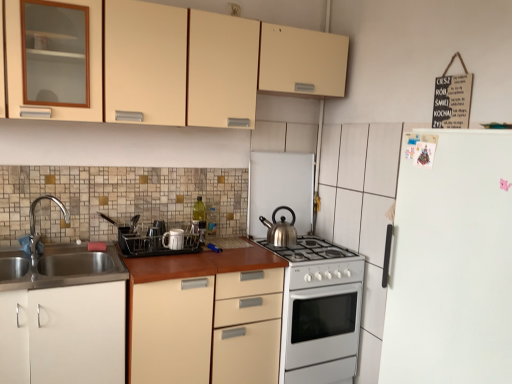
Question: From a real-world perspective, relative to matte plastic dish rack at center, which is the first appliance in left-to-right order, is brown laminate countertop at center vertically above or below?

Choices:
 (A) above
 (B) below

Answer: (B)

Question: Is brown laminate countertop at center inside the boundaries of matte plastic dish rack at center, which is the 3th appliance in right-to-left order, or outside?

Choices:
 (A) outside
 (B) inside

Answer: (A)

Question: Considering the real-world distances, which object is closest to the satin silver kettle at center, arranged as the 3th appliance when viewed from the left?

Choices:
 (A) white glossy oven at center
 (B) white matte cabinet at lower left, arranged as the second cabinetry when viewed from the top
 (C) white glossy gas stove at center
 (D) chrome metallic faucet at left
 (E) brown laminate countertop at center

Answer: (C)

Question: Which of these objects is positioned farthest from the satin silver kettle at center, arranged as the 3th appliance when viewed from the left?

Choices:
 (A) matte beige cabinet at upper center, which is the 2th cabinetry in bottom-to-top order
 (B) matte plastic dish rack at center, which is the first appliance in left-to-right order
 (C) white matte refrigerator at right
 (D) white glossy gas stove at center
 (E) white glossy oven at center

Answer: (C)